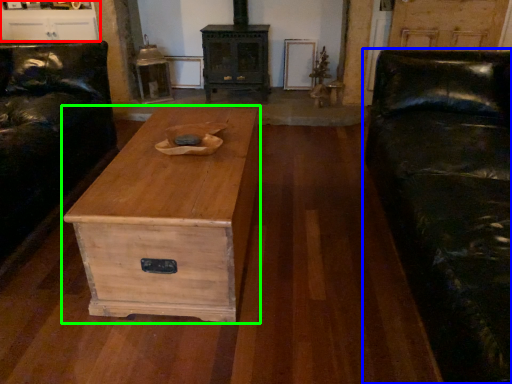
Question: Based on their relative distances, which object is nearer to entertainment center (highlighted by a red box)? Choose from studio couch (highlighted by a blue box) and chest of drawers (highlighted by a green box).

Choices:
 (A) studio couch
 (B) chest of drawers

Answer: (B)